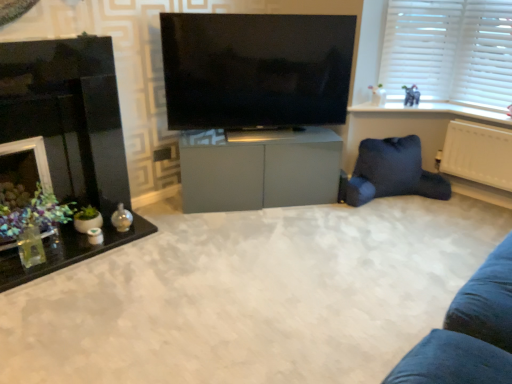
Question: Does matte gray cabinet at center lie in front of translucent glass table at left?

Choices:
 (A) yes
 (B) no

Answer: (A)

Question: Considering the relative positions of matte gray cabinet at center and translucent glass table at left in the image provided, is matte gray cabinet at center to the left of translucent glass table at left from the viewer's perspective?

Choices:
 (A) yes
 (B) no

Answer: (B)

Question: Is the depth of matte gray cabinet at center greater than that of translucent glass table at left?

Choices:
 (A) yes
 (B) no

Answer: (B)

Question: From the image's perspective, is matte gray cabinet at center under translucent glass table at left?

Choices:
 (A) yes
 (B) no

Answer: (A)

Question: Does matte gray cabinet at center have a greater height compared to translucent glass table at left?

Choices:
 (A) yes
 (B) no

Answer: (B)

Question: Can you confirm if matte gray cabinet at center is shorter than translucent glass table at left?

Choices:
 (A) yes
 (B) no

Answer: (A)

Question: From the image's perspective, does black glossy fireplace at left appear lower than matte gray cabinet at center?

Choices:
 (A) no
 (B) yes

Answer: (A)

Question: From the image's perspective, is black glossy fireplace at left above matte gray cabinet at center?

Choices:
 (A) yes
 (B) no

Answer: (A)

Question: Is black glossy fireplace at left closer to camera compared to matte gray cabinet at center?

Choices:
 (A) no
 (B) yes

Answer: (B)

Question: From a real-world perspective, is black glossy fireplace at left physically above matte gray cabinet at center?

Choices:
 (A) yes
 (B) no

Answer: (A)

Question: Can you confirm if black glossy fireplace at left is wider than matte gray cabinet at center?

Choices:
 (A) yes
 (B) no

Answer: (A)

Question: Does black glossy fireplace at left have a smaller size compared to matte gray cabinet at center?

Choices:
 (A) yes
 (B) no

Answer: (B)

Question: From the image's perspective, is dark blue fabric bean bag at lower right over matte gray elephant at upper right?

Choices:
 (A) no
 (B) yes

Answer: (A)